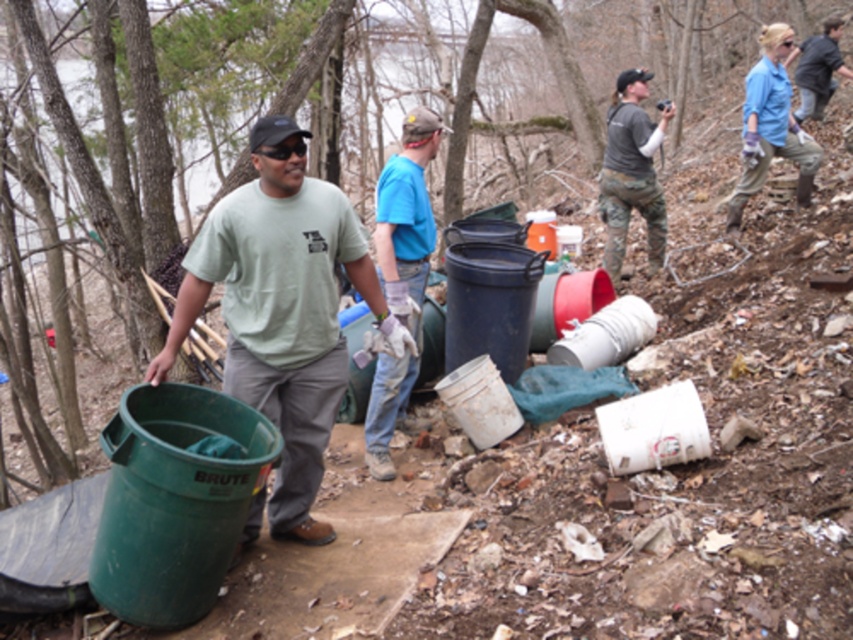
Looking at this image, you are a photographer trying to capture a closeup of the dark gray camouflage pants at center and the dark gray jacket at upper right in the scene. Since you want both items to appear equally sized in your photo, which object should you move closer to, and which should you move farther away?

The dark gray camouflage pants at center is smaller than the dark gray jacket at upper right. To make them appear the same size in the photo, you should move closer to the dark gray camouflage pants at center and move farther away from the dark gray jacket at upper right.

In the scene shown: You are standing in the wooded area and need to determine which object is taller between the dark gray camouflage pants at center and the blue cotton shirt at upper right. Based on the scene, which one is taller?

The dark gray camouflage pants at center is taller than the blue cotton shirt at upper right according to the description.